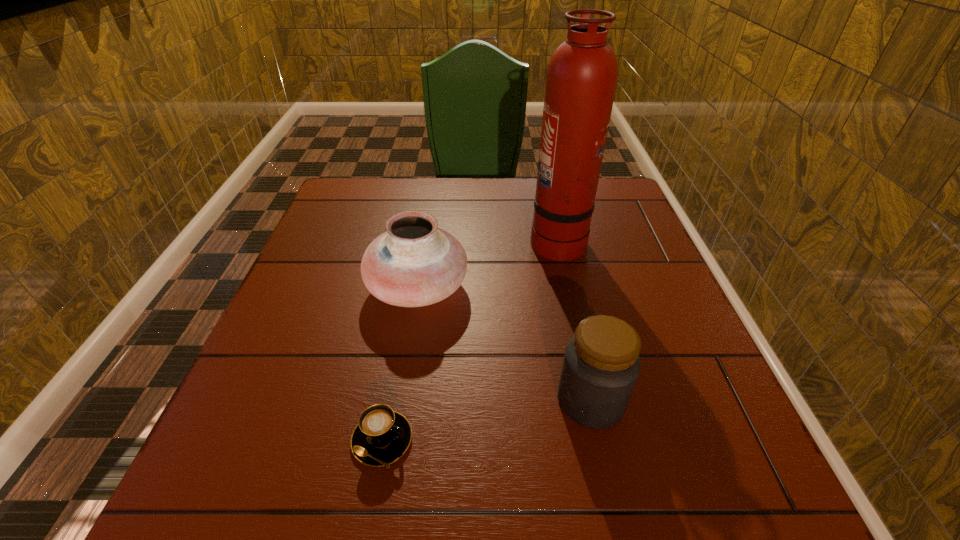
Locate an element on the screen. the second closest object to the jar is located at coordinates (382, 436).

Where is `the second closest object to the jar`? Image resolution: width=960 pixels, height=540 pixels. the second closest object to the jar is located at coordinates (382, 436).